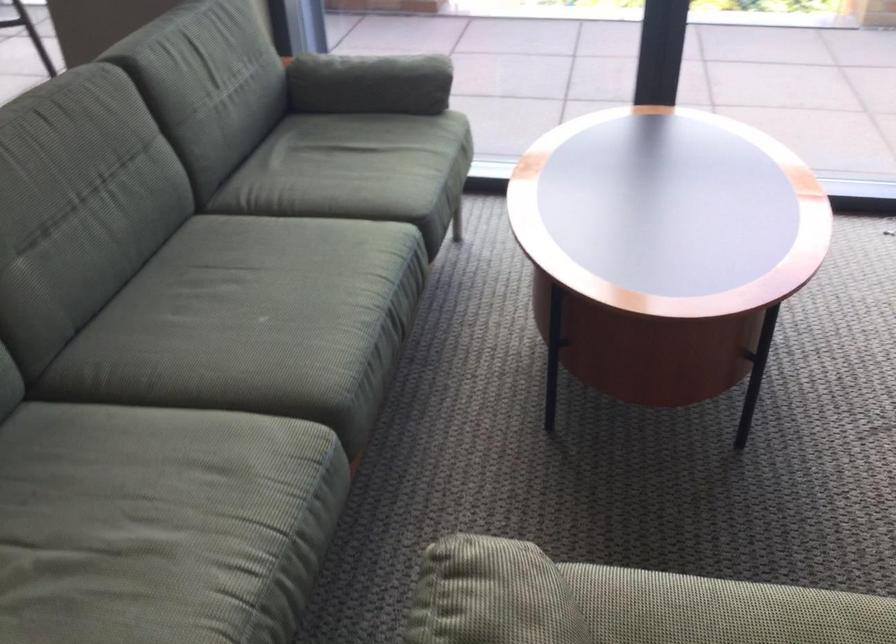
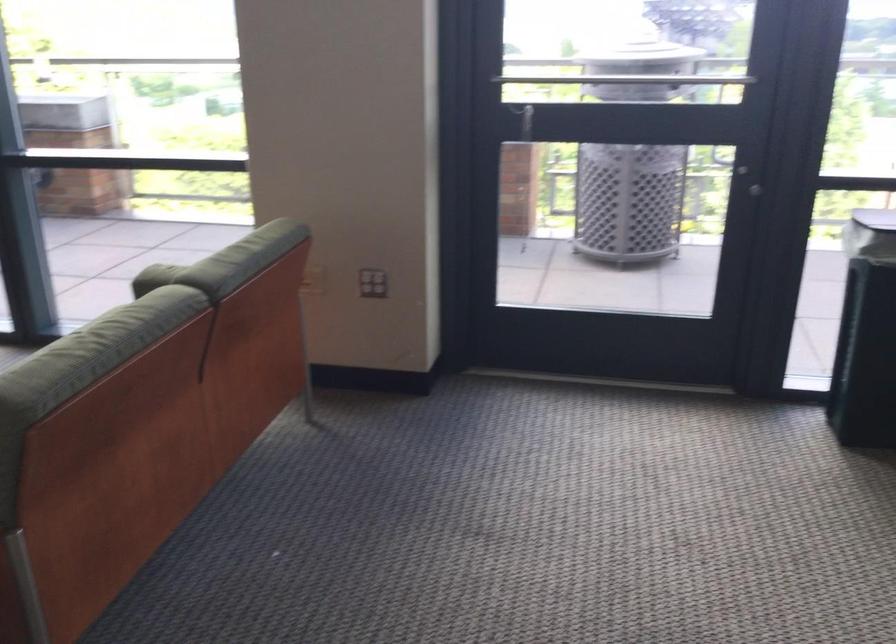
Question: Which direction would the cameraman need to move to produce the second image? Reply with the corresponding letter.

Choices:
 (A) Left
 (B) Right
 (C) Forward
 (D) Backward

Answer: (B)